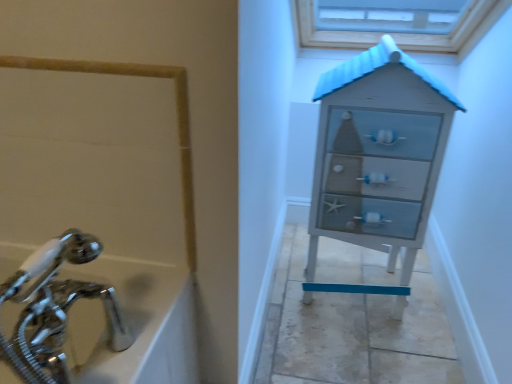
Question: Is chrome metallic faucet at lower left looking in the opposite direction of distressed white chest of drawers at right?

Choices:
 (A) yes
 (B) no

Answer: (B)

Question: Considering the relative sizes of chrome metallic faucet at lower left and distressed white chest of drawers at right in the image provided, is chrome metallic faucet at lower left bigger than distressed white chest of drawers at right?

Choices:
 (A) no
 (B) yes

Answer: (A)

Question: Considering the relative sizes of chrome metallic faucet at lower left and distressed white chest of drawers at right in the image provided, is chrome metallic faucet at lower left thinner than distressed white chest of drawers at right?

Choices:
 (A) no
 (B) yes

Answer: (B)

Question: Is chrome metallic faucet at lower left not close to distressed white chest of drawers at right?

Choices:
 (A) yes
 (B) no

Answer: (B)

Question: Can you confirm if chrome metallic faucet at lower left is smaller than distressed white chest of drawers at right?

Choices:
 (A) no
 (B) yes

Answer: (B)

Question: Does chrome metallic faucet at lower left come behind distressed white chest of drawers at right?

Choices:
 (A) no
 (B) yes

Answer: (A)

Question: Is distressed white chest of drawers at right further to the viewer compared to chrome metallic faucet at lower left?

Choices:
 (A) yes
 (B) no

Answer: (A)

Question: Considering the relative positions of distressed white chest of drawers at right and chrome metallic faucet at lower left in the image provided, is distressed white chest of drawers at right to the right of chrome metallic faucet at lower left from the viewer's perspective?

Choices:
 (A) yes
 (B) no

Answer: (A)

Question: From the image's perspective, would you say distressed white chest of drawers at right is positioned over chrome metallic faucet at lower left?

Choices:
 (A) yes
 (B) no

Answer: (A)

Question: Considering the relative sizes of distressed white chest of drawers at right and chrome metallic faucet at lower left in the image provided, is distressed white chest of drawers at right smaller than chrome metallic faucet at lower left?

Choices:
 (A) yes
 (B) no

Answer: (B)

Question: Is distressed white chest of drawers at right completely or partially outside of chrome metallic faucet at lower left?

Choices:
 (A) no
 (B) yes

Answer: (B)

Question: Is distressed white chest of drawers at right aimed at chrome metallic faucet at lower left?

Choices:
 (A) no
 (B) yes

Answer: (A)

Question: Visually, is distressed white chest of drawers at right positioned to the left or to the right of chrome metallic faucet at lower left?

Choices:
 (A) left
 (B) right

Answer: (B)